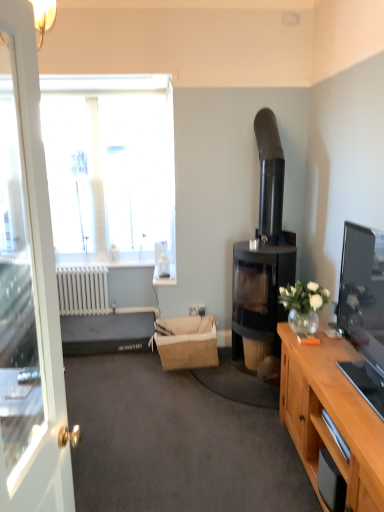
Find the location of a particular element. This screenshot has width=384, height=512. free space in front of dark gray fabric bed at lower left is located at coordinates (118, 375).